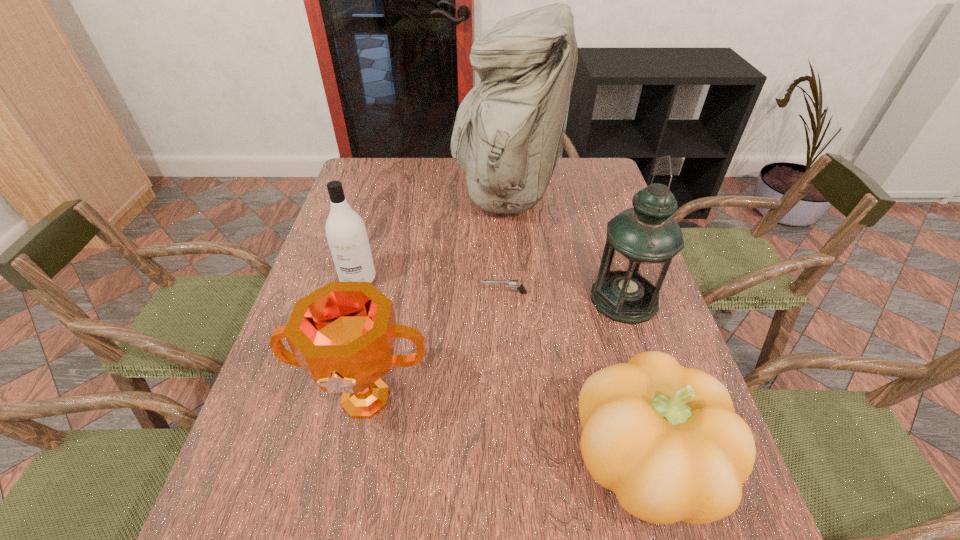
You are a GUI agent. You are given a task and a screenshot of the screen. Output one action in this format:
    pyautogui.click(x=<x>, y=<y>)
    Task: Click on the free space located 0.340m on the front-facing side of the shampoo
    The width and height of the screenshot is (960, 540).
    Given the screenshot: What is the action you would take?
    pyautogui.click(x=322, y=409)

This screenshot has width=960, height=540. I want to click on vacant space situated 0.060m on the side of the award with the star emblem, so click(x=350, y=471).

Image resolution: width=960 pixels, height=540 pixels. What are the coordinates of `vacant space positioned on the front-facing side of the shortest object` in the screenshot? It's located at (367, 293).

At what (x,y) coordinates should I click in order to perform the action: click on free space located on the front-facing side of the shortest object. Please return your answer as a coordinate pair (x, y). The width and height of the screenshot is (960, 540). Looking at the image, I should click on (446, 293).

Locate an element on the screen. vacant area situated 0.220m on the front-facing side of the shortest object is located at coordinates (x=397, y=293).

In order to click on object situated at the far edge in this screenshot , I will do `click(507, 134)`.

You are a GUI agent. You are given a task and a screenshot of the screen. Output one action in this format:
    pyautogui.click(x=<x>, y=<y>)
    Task: Click on the shampoo located at the left edge
    The width and height of the screenshot is (960, 540).
    Given the screenshot: What is the action you would take?
    pyautogui.click(x=346, y=233)

Locate an element on the screen. This screenshot has height=540, width=960. award situated at the left edge is located at coordinates (343, 334).

Where is `object present at the right edge`? The width and height of the screenshot is (960, 540). object present at the right edge is located at coordinates (641, 241).

In the image, there is a desktop. At what (x,y) coordinates should I click in order to perform the action: click on vacant space at the far edge. Please return your answer as a coordinate pair (x, y). The width and height of the screenshot is (960, 540). Looking at the image, I should click on (402, 177).